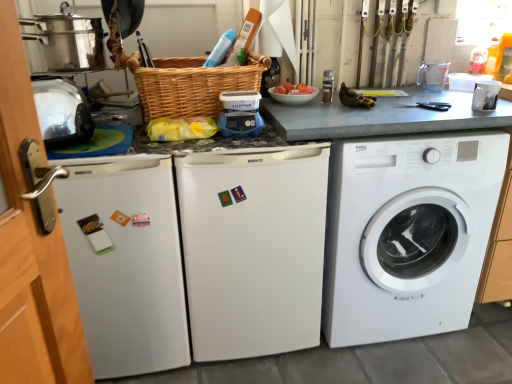
The image size is (512, 384). Describe the element at coordinates (485, 95) in the screenshot. I see `white glossy mug at upper right, arranged as the fourth appliance when viewed from the left` at that location.

The image size is (512, 384). Describe the element at coordinates (408, 233) in the screenshot. I see `white matte washing machine at right` at that location.

Measure the distance between white matte washing machine at right and camera.

A distance of 4.50 feet exists between white matte washing machine at right and camera.

What do you see at coordinates (253, 248) in the screenshot? This screenshot has height=384, width=512. I see `white matte dishwasher at center, which ranks as the second dish washer in left-to-right order` at bounding box center [253, 248].

Based on the photo, in order to face blue plastic scale at center, the 2th appliance positioned from the left, should I rotate leftwards or rightwards?

Turn left by 2.355 degrees to look at blue plastic scale at center, the 2th appliance positioned from the left.

How much space does matte black grinder at upper center, the third appliance positioned from the left, occupy vertically?

The height of matte black grinder at upper center, the third appliance positioned from the left, is 5.07 inches.

The width and height of the screenshot is (512, 384). What do you see at coordinates (328, 86) in the screenshot? I see `matte black grinder at upper center, arranged as the second appliance when viewed from the right` at bounding box center [328, 86].

This screenshot has width=512, height=384. I want to click on woven brown basket at center, so 191,85.

What are the coordinates of `white glossy mug at upper right, arranged as the fourth appliance when viewed from the left` in the screenshot? It's located at (485, 95).

Find the location of a particular element. the 2nd dish washer below when counting from the shiny metallic toaster at left, which appears as the 1th appliance when viewed from the left (from the image's perspective) is located at coordinates (126, 262).

From a real-world perspective, who is located higher, white matte dishwasher at left, placed as the first dish washer when sorted from left to right, or shiny metallic toaster at left, which appears as the 1th appliance when viewed from the left?

From a 3D spatial view, shiny metallic toaster at left, which appears as the 1th appliance when viewed from the left, is above.

From the picture: Considering the sizes of objects white matte dishwasher at left, placed as the first dish washer when sorted from left to right, and shiny metallic toaster at left, the 4th appliance in the right-to-left sequence, in the image provided, who is bigger, white matte dishwasher at left, placed as the first dish washer when sorted from left to right, or shiny metallic toaster at left, the 4th appliance in the right-to-left sequence,?

With larger size is white matte dishwasher at left, placed as the first dish washer when sorted from left to right.

Which object is thinner, white matte dishwasher at left, placed as the first dish washer when sorted from left to right, or shiny metallic toaster at left, which appears as the 1th appliance when viewed from the left?

shiny metallic toaster at left, which appears as the 1th appliance when viewed from the left, is thinner.

How much distance is there between blue plastic scale at center, the third appliance positioned from the right, and white glossy mug at upper right, arranged as the fourth appliance when viewed from the left?

They are 31.48 inches apart.

From a real-world perspective, is blue plastic scale at center, the 2th appliance positioned from the left, physically below white glossy mug at upper right, arranged as the fourth appliance when viewed from the left?

No.

How many degrees apart are the facing directions of blue plastic scale at center, the 2th appliance positioned from the left, and white glossy mug at upper right, arranged as the fourth appliance when viewed from the left?

112 degrees separate the facing orientations of blue plastic scale at center, the 2th appliance positioned from the left, and white glossy mug at upper right, arranged as the fourth appliance when viewed from the left.

Does blue plastic scale at center, the 2th appliance positioned from the left, have a smaller size compared to white glossy mug at upper right, arranged as the fourth appliance when viewed from the left?

Indeed, blue plastic scale at center, the 2th appliance positioned from the left, has a smaller size compared to white glossy mug at upper right, arranged as the fourth appliance when viewed from the left.

From the image's perspective, who appears lower, white matte washing machine at right or matte black grinder at upper center, arranged as the second appliance when viewed from the right?

white matte washing machine at right, from the image's perspective.

Which of these two, white matte washing machine at right or matte black grinder at upper center, the third appliance positioned from the left, is thinner?

matte black grinder at upper center, the third appliance positioned from the left, is thinner.

Considering their positions, is white matte washing machine at right located in front of or behind matte black grinder at upper center, the third appliance positioned from the left?

In the image, white matte washing machine at right appears in front of matte black grinder at upper center, the third appliance positioned from the left.

Between shiny metallic toaster at left, which appears as the 1th appliance when viewed from the left, and woven brown basket at center, which one has larger width?

With larger width is woven brown basket at center.

From the image's perspective, starting from the woven brown basket at center, which appliance is the 4th one below? Please provide its 2D coordinates.

[(62, 113)]

Is woven brown basket at center located within shiny metallic toaster at left, the 4th appliance in the right-to-left sequence?

No, woven brown basket at center is not surrounded by shiny metallic toaster at left, the 4th appliance in the right-to-left sequence.

From a real-world perspective, between shiny metallic toaster at left, the 4th appliance in the right-to-left sequence, and woven brown basket at center, who is vertically lower?

shiny metallic toaster at left, the 4th appliance in the right-to-left sequence, is physically lower.

From the image's perspective, is white matte dishwasher at center, which is counted as the first dish washer, starting from the right, located above or below white matte dishwasher at left, placed as the first dish washer when sorted from left to right?

Clearly, from the image's perspective, white matte dishwasher at center, which is counted as the first dish washer, starting from the right, is above white matte dishwasher at left, placed as the first dish washer when sorted from left to right.

Could you tell me if white matte dishwasher at center, which is counted as the first dish washer, starting from the right, is facing white matte dishwasher at left, placed as the first dish washer when sorted from left to right?

No, white matte dishwasher at center, which is counted as the first dish washer, starting from the right, does not turn towards white matte dishwasher at left, placed as the first dish washer when sorted from left to right.

Which is behind, point (269, 200) or point (97, 212)?

The point (269, 200) is behind.

This screenshot has height=384, width=512. What are the coordinates of `the 2nd dish washer below the white glossy mug at upper right, the 1th appliance positioned from the right (from the image's perspective)` in the screenshot? It's located at (126, 262).

Looking at this image, which is closer, [480,91] or [76,190]?

Point [480,91].

Is white glossy mug at upper right, the 1th appliance positioned from the right, aimed at white matte dishwasher at left, placed as the 2th dish washer when sorted from right to left?

No, white glossy mug at upper right, the 1th appliance positioned from the right, is not oriented towards white matte dishwasher at left, placed as the 2th dish washer when sorted from right to left.

From a real-world perspective, which is physically above, white glossy mug at upper right, arranged as the fourth appliance when viewed from the left, or white matte dishwasher at left, placed as the 2th dish washer when sorted from right to left?

From a 3D spatial view, white glossy mug at upper right, arranged as the fourth appliance when viewed from the left, is above.

Does point (87, 124) appear closer or farther from the camera than point (243, 115)?

Point (87, 124) appears to be closer to the viewer than point (243, 115).

Considering the sizes of objects shiny metallic toaster at left, which appears as the 1th appliance when viewed from the left, and blue plastic scale at center, the third appliance positioned from the right, in the image provided, who is wider, shiny metallic toaster at left, which appears as the 1th appliance when viewed from the left, or blue plastic scale at center, the third appliance positioned from the right,?

With larger width is shiny metallic toaster at left, which appears as the 1th appliance when viewed from the left.

Which object is closer to the camera taking this photo, shiny metallic toaster at left, which appears as the 1th appliance when viewed from the left, or blue plastic scale at center, the third appliance positioned from the right?

Positioned in front is shiny metallic toaster at left, which appears as the 1th appliance when viewed from the left.

Between shiny metallic toaster at left, the 4th appliance in the right-to-left sequence, and blue plastic scale at center, the third appliance positioned from the right, which one appears on the left side from the viewer's perspective?

Positioned to the left is shiny metallic toaster at left, the 4th appliance in the right-to-left sequence.

I want to click on appliance in front of the white matte dishwasher at left, placed as the first dish washer when sorted from left to right, so click(x=62, y=113).

Find the location of a particular element. This screenshot has width=512, height=384. appliance below the blue plastic scale at center, the third appliance positioned from the right (from a real-world perspective) is located at coordinates (485, 95).

Estimate the real-world distances between objects in this image. Which object is further from white matte dishwasher at center, which ranks as the second dish washer in left-to-right order, matte black grinder at upper center, the third appliance positioned from the left, or white matte dishwasher at left, placed as the first dish washer when sorted from left to right?

matte black grinder at upper center, the third appliance positioned from the left.

Which object lies nearer to the anchor point white matte dishwasher at center, which is counted as the first dish washer, starting from the right, blue plastic scale at center, the third appliance positioned from the right, or white matte dishwasher at left, placed as the 2th dish washer when sorted from right to left?

The object closer to white matte dishwasher at center, which is counted as the first dish washer, starting from the right, is white matte dishwasher at left, placed as the 2th dish washer when sorted from right to left.

When comparing their distances from woven brown basket at center, does shiny metallic toaster at left, the 4th appliance in the right-to-left sequence, or white glossy mug at upper right, the 1th appliance positioned from the right, seem further?

white glossy mug at upper right, the 1th appliance positioned from the right, lies further to woven brown basket at center than the other object.

Which object lies nearer to the anchor point white glossy mug at upper right, the 1th appliance positioned from the right, matte black grinder at upper center, the third appliance positioned from the left, or woven brown basket at center?

matte black grinder at upper center, the third appliance positioned from the left, is positioned closer to the anchor white glossy mug at upper right, the 1th appliance positioned from the right.

Estimate the real-world distances between objects in this image. Which object is further from white matte washing machine at right, shiny metallic toaster at left, the 4th appliance in the right-to-left sequence, or woven brown basket at center?

shiny metallic toaster at left, the 4th appliance in the right-to-left sequence.

When comparing their distances from shiny metallic toaster at left, the 4th appliance in the right-to-left sequence, does white matte washing machine at right or woven brown basket at center seem closer?

woven brown basket at center lies closer to shiny metallic toaster at left, the 4th appliance in the right-to-left sequence, than the other object.

Considering their positions, is white matte dishwasher at left, placed as the 2th dish washer when sorted from right to left, positioned closer to blue plastic scale at center, the 2th appliance positioned from the left, than shiny metallic toaster at left, the 4th appliance in the right-to-left sequence?

shiny metallic toaster at left, the 4th appliance in the right-to-left sequence, lies closer to blue plastic scale at center, the 2th appliance positioned from the left, than the other object.

Based on their spatial positions, is shiny metallic toaster at left, which appears as the 1th appliance when viewed from the left, or woven brown basket at center further from blue plastic scale at center, the third appliance positioned from the right?

Among the two, shiny metallic toaster at left, which appears as the 1th appliance when viewed from the left, is located further to blue plastic scale at center, the third appliance positioned from the right.

Where is `basket between shiny metallic toaster at left, which appears as the 1th appliance when viewed from the left, and white matte washing machine at right from left to right`? This screenshot has width=512, height=384. basket between shiny metallic toaster at left, which appears as the 1th appliance when viewed from the left, and white matte washing machine at right from left to right is located at coordinates (191, 85).

Locate an element on the screen. The height and width of the screenshot is (384, 512). basket situated between white matte dishwasher at left, placed as the first dish washer when sorted from left to right, and matte black grinder at upper center, the third appliance positioned from the left, from left to right is located at coordinates (191, 85).

The width and height of the screenshot is (512, 384). In order to click on washing machine that lies between matte black grinder at upper center, the third appliance positioned from the left, and white matte dishwasher at center, which ranks as the second dish washer in left-to-right order, from top to bottom in this screenshot , I will do `click(408, 233)`.

What are the coordinates of `washing machine between blue plastic scale at center, the third appliance positioned from the right, and white glossy mug at upper right, arranged as the fourth appliance when viewed from the left, in the horizontal direction` in the screenshot? It's located at (408, 233).